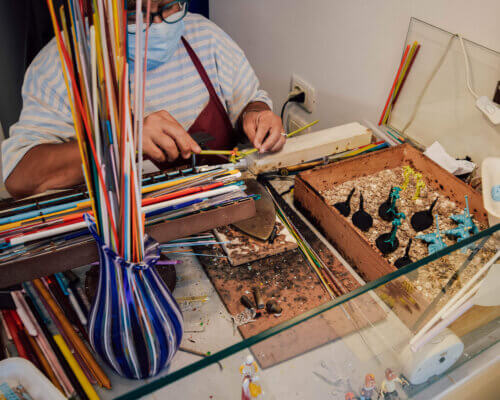
The image size is (500, 400). I want to click on glass, so click(375, 329).